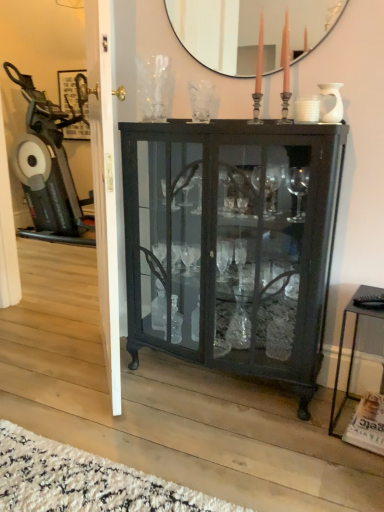
Find the location of a particular element. Image resolution: width=384 pixels, height=512 pixels. free point above white shag rug at lower left (from a real-world perspective) is located at coordinates (64, 478).